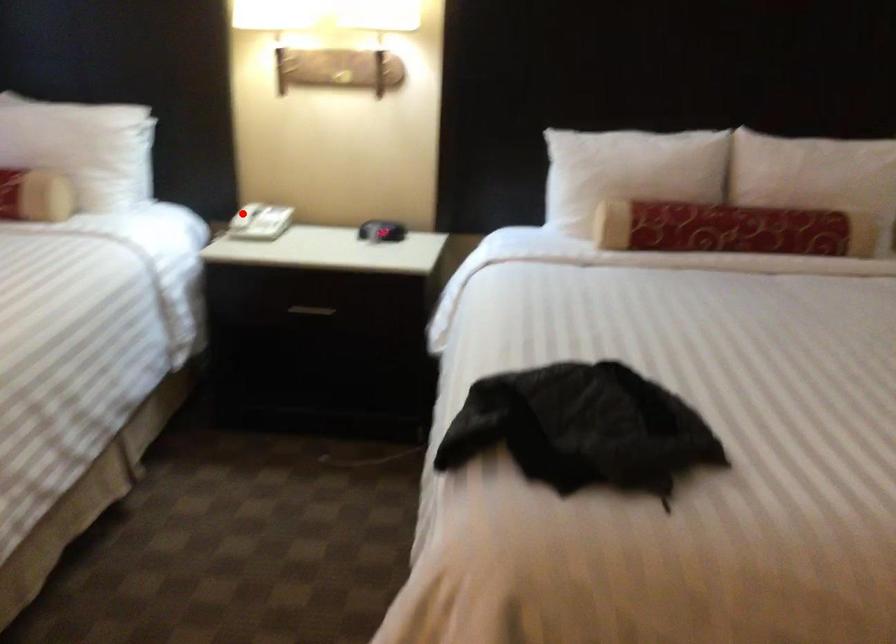
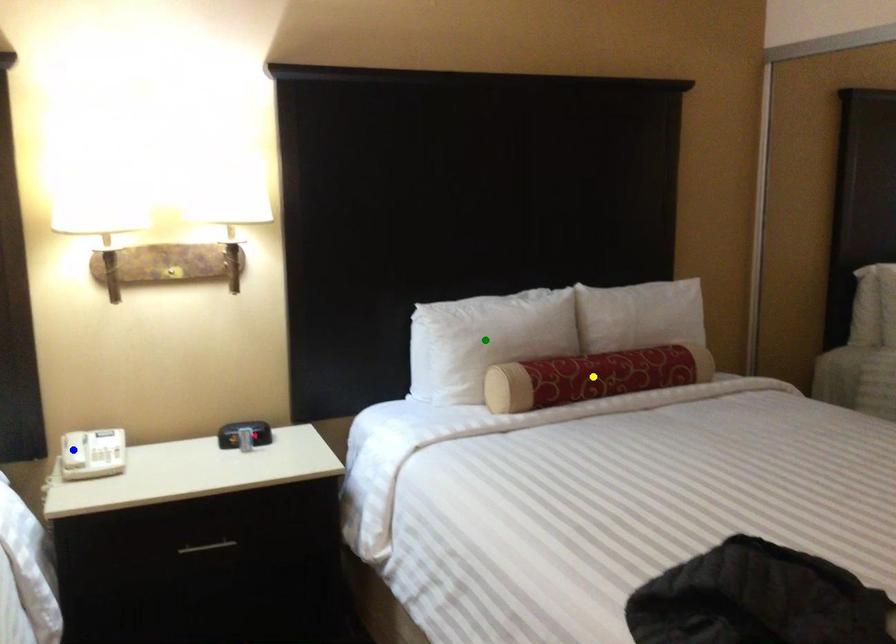
Question: I am providing you with two images of the same scene from different viewpoints. A red point is marked on the first image. You are given multiple points on the second image. Can you choose the point in image 2 that corresponds to the point in image 1?

Choices:
 (A) yellow point
 (B) green point
 (C) blue point

Answer: (C)